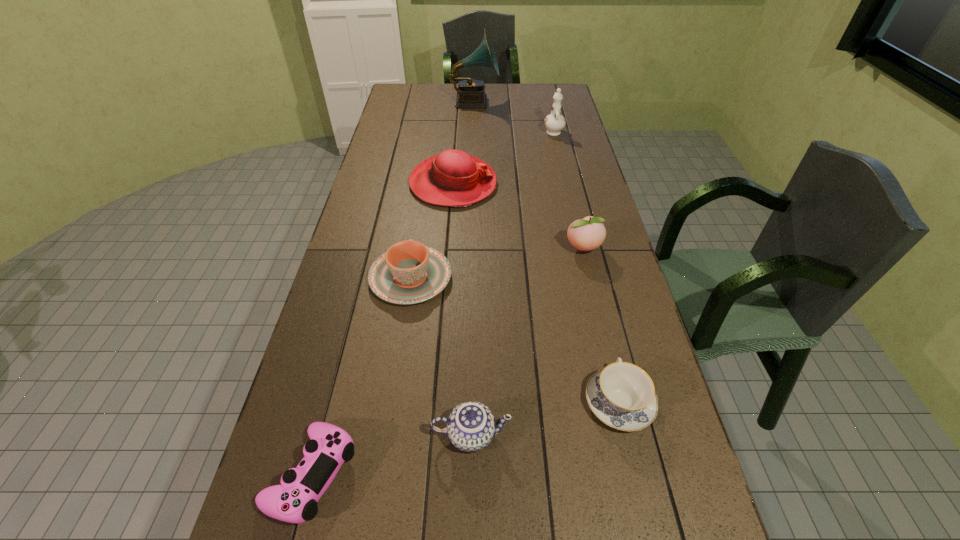
Locate an element on the screen. The width and height of the screenshot is (960, 540). the farthest object is located at coordinates (470, 93).

I want to click on phonograph_record, so [470, 93].

Where is `the seventh shortest object`? This screenshot has height=540, width=960. the seventh shortest object is located at coordinates tap(555, 122).

At what (x,y) coordinates should I click in order to perform the action: click on the farthest chinaware. Please return your answer as a coordinate pair (x, y). The height and width of the screenshot is (540, 960). Looking at the image, I should click on (555, 122).

You are a GUI agent. You are given a task and a screenshot of the screen. Output one action in this format:
    pyautogui.click(x=<x>, y=<y>)
    Task: Click on the hat
    This screenshot has height=540, width=960.
    Given the screenshot: What is the action you would take?
    pyautogui.click(x=453, y=178)

Where is `peach`? peach is located at coordinates (586, 234).

At what (x,y) coordinates should I click in order to perform the action: click on the second farthest chinaware. Please return your answer as a coordinate pair (x, y). The height and width of the screenshot is (540, 960). Looking at the image, I should click on (409, 272).

Identify the location of control. Image resolution: width=960 pixels, height=540 pixels. [295, 501].

Where is `the shortest chinaware`? This screenshot has width=960, height=540. the shortest chinaware is located at coordinates (622, 395).

Image resolution: width=960 pixels, height=540 pixels. I want to click on free space located from the horn of the tallest object, so [x=554, y=102].